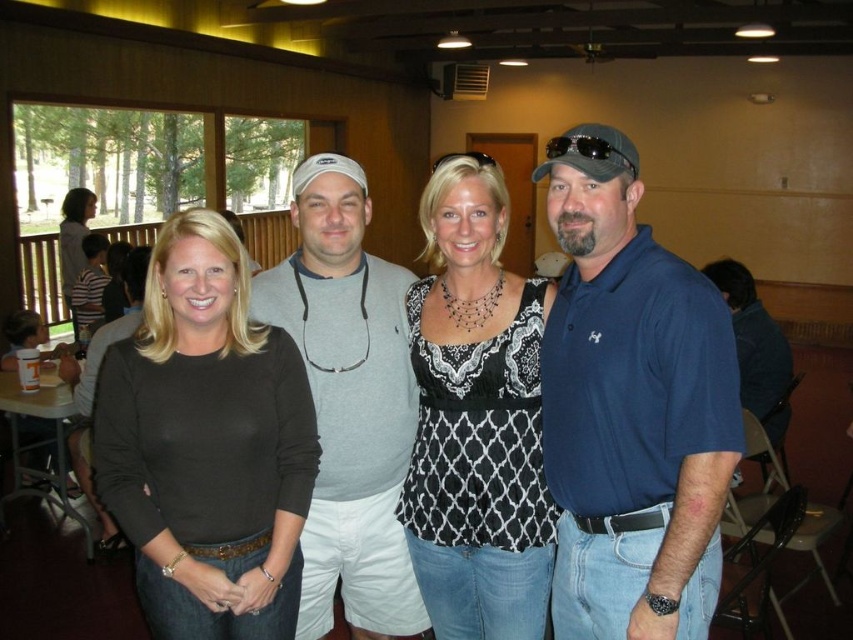
Is point (329, 264) positioned behind point (67, 248)?

That is False.

Which is below, gray cotton sweater at center or blonde hair at upper left?

gray cotton sweater at center is lower down.

This screenshot has height=640, width=853. Find the location of `gray cotton sweater at center`. gray cotton sweater at center is located at coordinates click(x=349, y=403).

Which is behind, point (299, 378) or point (509, 616)?

The point (509, 616) is more distant.

Between point (265, 612) and point (474, 394), which one is positioned in front?

Point (265, 612) is in front.

Which is in front, point (300, 444) or point (503, 602)?

Point (300, 444) is more forward.

Where is `dark brown sweater at center`? dark brown sweater at center is located at coordinates (206, 444).

Can you confirm if blue cotton polo shirt at right is positioned below dark brown sweater at center?

No, blue cotton polo shirt at right is not below dark brown sweater at center.

Between point (585, 547) and point (280, 538), which one is positioned in front?

Point (585, 547) is more forward.

This screenshot has height=640, width=853. I want to click on blue cotton polo shirt at right, so 631,406.